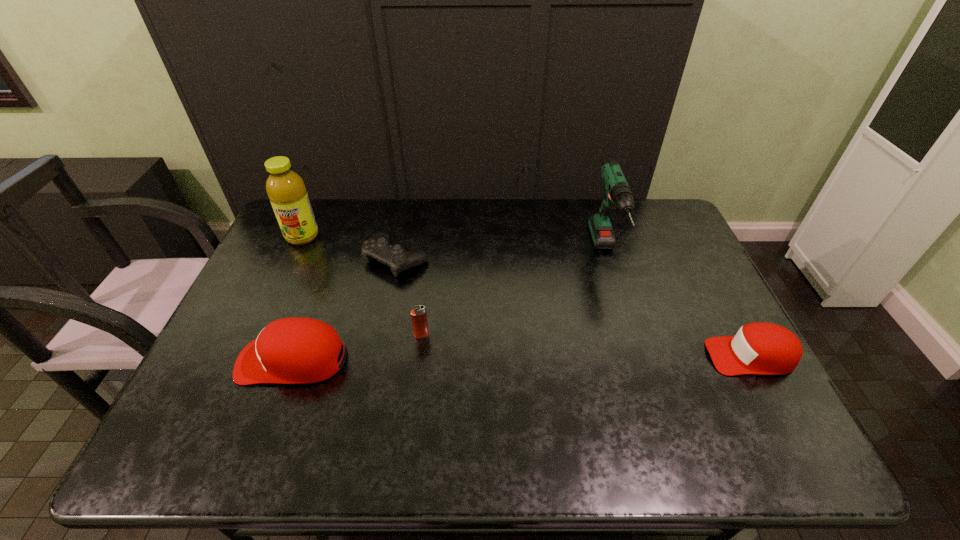
Where is `vacant area situated on the back of the control`? This screenshot has width=960, height=540. vacant area situated on the back of the control is located at coordinates (405, 218).

The image size is (960, 540). Identify the location of free space located on the handle side of the fifth object from left to right. (643, 378).

What are the coordinates of `vacant space located 0.360m on the back of the igniter` in the screenshot? It's located at (432, 246).

The width and height of the screenshot is (960, 540). Identify the location of vacant region located 0.080m on the front label of the fruit juice. (290, 264).

Locate an element on the screen. This screenshot has width=960, height=540. control that is at the far edge is located at coordinates (378, 247).

Where is `drill present at the far edge`? drill present at the far edge is located at coordinates (618, 194).

Identify the location of fruit juice present at the far edge. (286, 190).

The image size is (960, 540). I want to click on object that is positioned at the near edge, so (297, 350).

This screenshot has width=960, height=540. In order to click on baseball cap that is at the left edge in this screenshot , I will do `click(297, 350)`.

At what (x,y) coordinates should I click in order to perform the action: click on fruit juice positioned at the left edge. Please return your answer as a coordinate pair (x, y). The width and height of the screenshot is (960, 540). Looking at the image, I should click on pos(286,190).